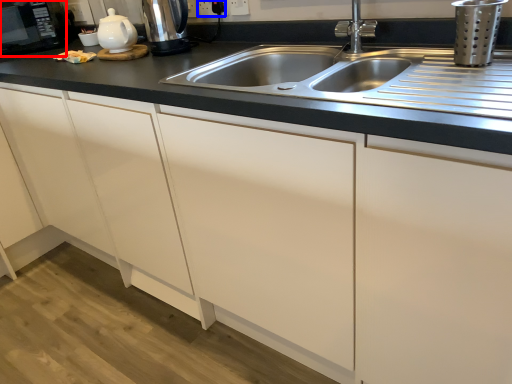
Question: Which object appears farthest to the camera in this image, appliance (highlighted by a red box) or electric outlet (highlighted by a blue box)?

Choices:
 (A) appliance
 (B) electric outlet

Answer: (A)